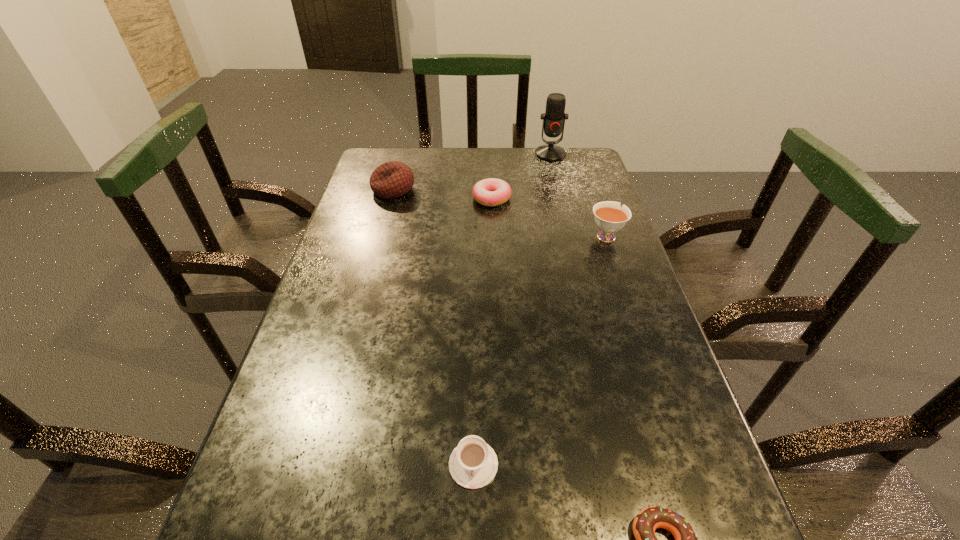
This screenshot has width=960, height=540. I want to click on blank space located 0.170m on the side of the fourth farthest object with the handle, so click(x=590, y=190).

The width and height of the screenshot is (960, 540). What are the coordinates of `vacant space located 0.210m on the side of the fourth farthest object with the handle` in the screenshot? It's located at (588, 183).

The image size is (960, 540). What are the coordinates of `vacant region located on the back of the leftmost object` in the screenshot? It's located at (403, 151).

What are the coordinates of `free space located 0.270m on the right of the left doughnut` in the screenshot? It's located at (603, 199).

Where is `microphone situated at the far edge`? The image size is (960, 540). microphone situated at the far edge is located at coordinates (554, 117).

This screenshot has width=960, height=540. Identify the location of beanbag located at the far edge. (393, 179).

The height and width of the screenshot is (540, 960). Identify the location of object located in the left edge section of the desktop. (393, 179).

The width and height of the screenshot is (960, 540). Find the location of `microphone situated at the right edge`. microphone situated at the right edge is located at coordinates (554, 117).

Locate an element on the screen. The height and width of the screenshot is (540, 960). teacup located in the right edge section of the desktop is located at coordinates (610, 217).

Locate an element on the screen. object that is at the far left corner is located at coordinates (393, 179).